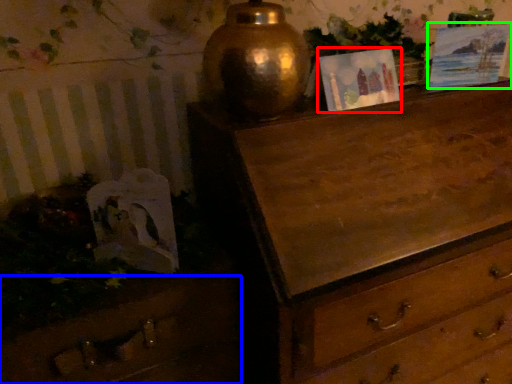
Question: Which object is positioned closest to picture frame (highlighted by a red box)? Select from drawer (highlighted by a blue box) and picture frame (highlighted by a green box).

Choices:
 (A) drawer
 (B) picture frame

Answer: (B)